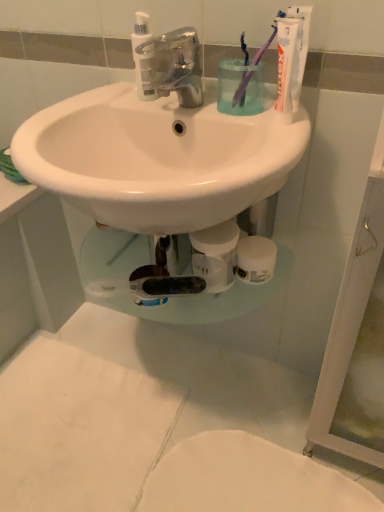
Question: Considering the relative sizes of purple plastic toothbrush at upper right, the 2th toothbrush positioned from the left, and chrome metallic faucet at center in the image provided, is purple plastic toothbrush at upper right, the 2th toothbrush positioned from the left, bigger than chrome metallic faucet at center?

Choices:
 (A) yes
 (B) no

Answer: (B)

Question: Does purple plastic toothbrush at upper right, the 2th toothbrush positioned from the left, have a greater height compared to chrome metallic faucet at center?

Choices:
 (A) yes
 (B) no

Answer: (A)

Question: Does purple plastic toothbrush at upper right, which is counted as the 1th toothbrush, starting from the right, come behind chrome metallic faucet at center?

Choices:
 (A) yes
 (B) no

Answer: (A)

Question: Is purple plastic toothbrush at upper right, which is counted as the 1th toothbrush, starting from the right, at the left side of chrome metallic faucet at center?

Choices:
 (A) no
 (B) yes

Answer: (A)

Question: Could you tell me if purple plastic toothbrush at upper right, which is counted as the 1th toothbrush, starting from the right, is facing chrome metallic faucet at center?

Choices:
 (A) no
 (B) yes

Answer: (A)

Question: Considering the positions of chrome metallic faucet at center and white matte toilet at lower center in the image, is chrome metallic faucet at center taller or shorter than white matte toilet at lower center?

Choices:
 (A) short
 (B) tall

Answer: (B)

Question: From the image's perspective, is chrome metallic faucet at center above or below white matte toilet at lower center?

Choices:
 (A) above
 (B) below

Answer: (A)

Question: Looking at their shapes, would you say chrome metallic faucet at center is wider or thinner than white matte toilet at lower center?

Choices:
 (A) thin
 (B) wide

Answer: (A)

Question: In the image, is chrome metallic faucet at center positioned in front of or behind white matte toilet at lower center?

Choices:
 (A) front
 (B) behind

Answer: (A)

Question: Does point (137, 16) appear closer or farther from the camera than point (244, 90)?

Choices:
 (A) farther
 (B) closer

Answer: (B)

Question: From their relative heights in the image, would you say translucent plastic pump bottle at upper center is taller or shorter than purple plastic toothbrush at upper right, which is counted as the 1th toothbrush, starting from the right?

Choices:
 (A) short
 (B) tall

Answer: (A)

Question: From a real-world perspective, relative to purple plastic toothbrush at upper right, which is counted as the 1th toothbrush, starting from the right, is translucent plastic pump bottle at upper center vertically above or below?

Choices:
 (A) above
 (B) below

Answer: (B)

Question: Considering the relative positions of translucent plastic pump bottle at upper center and purple plastic toothbrush at upper right, the 2th toothbrush positioned from the left, in the image provided, is translucent plastic pump bottle at upper center to the left or to the right of purple plastic toothbrush at upper right, the 2th toothbrush positioned from the left,?

Choices:
 (A) right
 (B) left

Answer: (B)

Question: Considering the positions of translucent plastic pump bottle at upper center and translucent plastic cup at upper center in the image, is translucent plastic pump bottle at upper center bigger or smaller than translucent plastic cup at upper center?

Choices:
 (A) small
 (B) big

Answer: (A)

Question: Do you think translucent plastic pump bottle at upper center is within translucent plastic cup at upper center, or outside of it?

Choices:
 (A) outside
 (B) inside

Answer: (A)